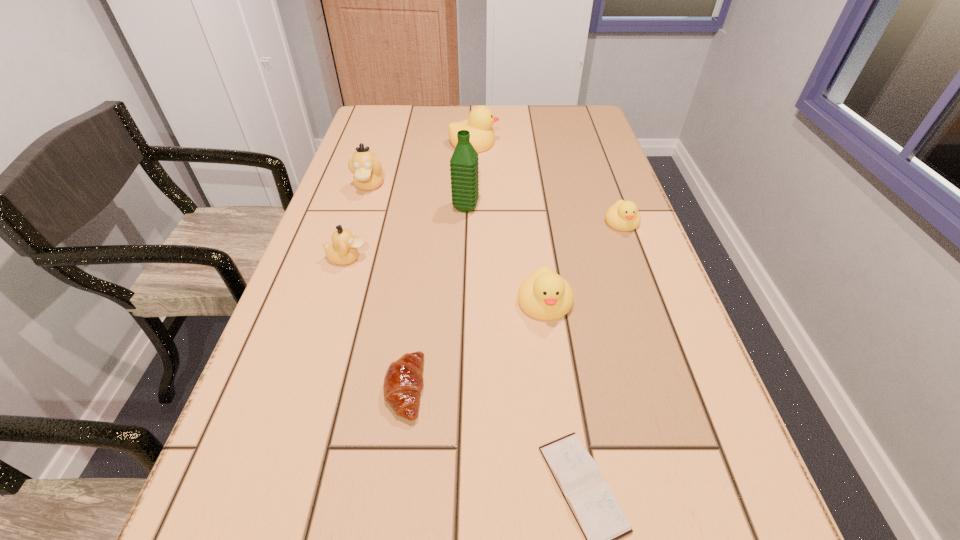
You are a GUI agent. You are given a task and a screenshot of the screen. Output one action in this format:
    pyautogui.click(x=<x>, y=<y>)
    Task: Click on the third farthest duckling
    The width and height of the screenshot is (960, 540).
    Given the screenshot: What is the action you would take?
    (x=623, y=215)

The image size is (960, 540). Identify the location of the rightmost object. (623, 215).

Identify the location of crescent roll. Image resolution: width=960 pixels, height=540 pixels. (403, 382).

What are the coordinates of `the seventh farthest object` in the screenshot? It's located at (403, 382).

What are the coordinates of `vacant area situated on the right of the water bottle` in the screenshot? It's located at (539, 207).

You are a GUI agent. You are given a task and a screenshot of the screen. Output one action in this format:
    pyautogui.click(x=<x>, y=<y>)
    Task: Click on the free space located 0.100m on the face of the bigger tan duckling
    
    Given the screenshot: What is the action you would take?
    pyautogui.click(x=358, y=222)

Where is `vacant space located 0.150m on the face of the farthest object`? Image resolution: width=960 pixels, height=540 pixels. vacant space located 0.150m on the face of the farthest object is located at coordinates (548, 143).

I want to click on blank space located 0.260m on the face of the nearest yellow duckling, so click(x=567, y=464).

Image resolution: width=960 pixels, height=540 pixels. I want to click on vacant space located 0.280m on the face of the fourth nearest object, so click(x=495, y=258).

Where is `free location located 0.060m on the face of the rightmost object`? free location located 0.060m on the face of the rightmost object is located at coordinates (633, 252).